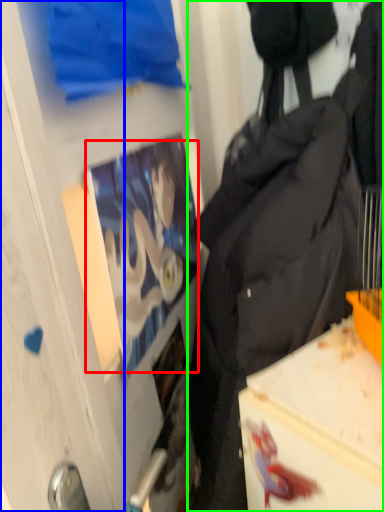
Question: Which object is the closest to the person (highlighted by a red box)? Choose among these: glass door (highlighted by a blue box) or backpack (highlighted by a green box).

Choices:
 (A) glass door
 (B) backpack

Answer: (B)